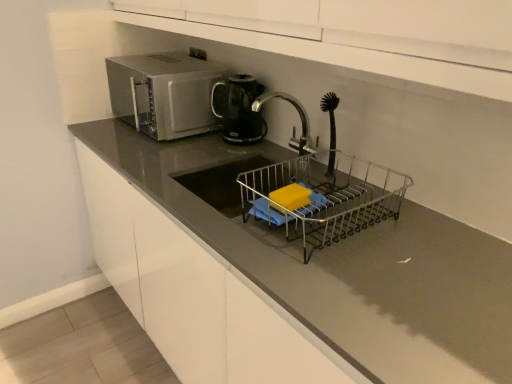
This screenshot has width=512, height=384. I want to click on free spot below metallic wire dish rack at center (from a real-world perspective), so click(x=340, y=221).